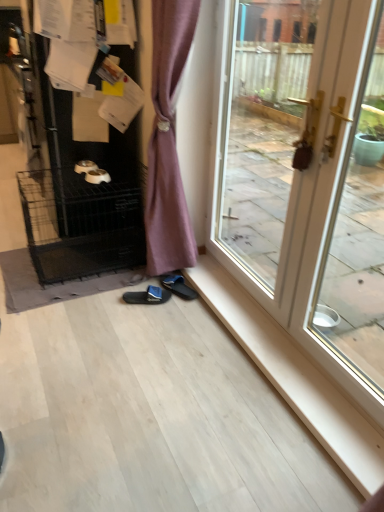
Locate an element on the screen. Image resolution: width=384 pixels, height=512 pixels. white glossy door at right is located at coordinates (261, 127).

Describe the element at coordinates (83, 176) in the screenshot. I see `black wire dog crate at left` at that location.

The image size is (384, 512). Identify the location of white glossy screen door at right. (358, 233).

Looking at this image, from the image's perspective, is white glossy screen door at right above black fabric slipper at lower center, which appears as the 2th footwear when viewed from the left?

Yes, from the image's perspective, white glossy screen door at right is on top of black fabric slipper at lower center, which appears as the 2th footwear when viewed from the left.

From a real-world perspective, is white glossy screen door at right positioned above or below black fabric slipper at lower center, which is the first footwear in right-to-left order?

In terms of real-world spatial position, white glossy screen door at right is above black fabric slipper at lower center, which is the first footwear in right-to-left order.

Is black fabric slipper at lower center, which appears as the 2th footwear when viewed from the left, at the back of white glossy screen door at right?

No, white glossy screen door at right's orientation is not away from black fabric slipper at lower center, which appears as the 2th footwear when viewed from the left.

Is black wire cage at left at the right side of black wire dog crate at left?

Correct, you'll find black wire cage at left to the right of black wire dog crate at left.

In the scene shown: Between black wire cage at left and black wire dog crate at left, which one has less height?

Standing shorter between the two is black wire cage at left.

From a real-world perspective, is black wire cage at left below black wire dog crate at left?

Yes.

Is there a large distance between black wire cage at left and black wire dog crate at left?

That's not correct — black wire cage at left is a little close to black wire dog crate at left.

Is there a large distance between white glossy door at right and black fabric slipper at lower center, which is counted as the 1th footwear, starting from the left?

Yes.

Considering the relative positions of white glossy door at right and black fabric slipper at lower center, the 2th footwear in the right-to-left sequence, in the image provided, is white glossy door at right in front of black fabric slipper at lower center, the 2th footwear in the right-to-left sequence,?

Yes.

Between white glossy door at right and black fabric slipper at lower center, which is counted as the 1th footwear, starting from the left, which one has smaller size?

Smaller between the two is black fabric slipper at lower center, which is counted as the 1th footwear, starting from the left.

Which of these two, white glossy door at right or black fabric slipper at lower center, the 2th footwear in the right-to-left sequence, is thinner?

white glossy door at right.

From the image's perspective, which object appears higher, black wire dog crate at left or white glossy screen door at right?

black wire dog crate at left, from the image's perspective.

Considering the relative sizes of black wire dog crate at left and white glossy screen door at right in the image provided, is black wire dog crate at left thinner than white glossy screen door at right?

No.

Find the location of a particular element. screen door above the black wire dog crate at left (from a real-world perspective) is located at coordinates (358, 233).

Considering the points (73, 151) and (344, 342), which point is behind, point (73, 151) or point (344, 342)?

The point (73, 151) is behind.

Can you confirm if black fabric slipper at lower center, which is the first footwear in right-to-left order, is thinner than black fabric slipper at lower center, the 2th footwear in the right-to-left sequence?

Yes, black fabric slipper at lower center, which is the first footwear in right-to-left order, is thinner than black fabric slipper at lower center, the 2th footwear in the right-to-left sequence.

Image resolution: width=384 pixels, height=512 pixels. Identify the location of footwear in front of the black fabric slipper at lower center, which appears as the 2th footwear when viewed from the left. (147, 296).

In the image, is black fabric slipper at lower center, which appears as the 2th footwear when viewed from the left, positioned in front of or behind black fabric slipper at lower center, which is counted as the 1th footwear, starting from the left?

black fabric slipper at lower center, which appears as the 2th footwear when viewed from the left, is behind black fabric slipper at lower center, which is counted as the 1th footwear, starting from the left.

From a real-world perspective, is white glossy door at right above or below black wire cage at left?

From a real-world perspective, white glossy door at right is physically above black wire cage at left.

The image size is (384, 512). Identify the location of cage below the white glossy door at right (from the image's perspective). (82, 222).

Are white glossy door at right and black wire cage at left making contact?

No, white glossy door at right is not beside black wire cage at left.

Is black wire cage at left completely or partially inside white glossy door at right?

No, black wire cage at left is located outside of white glossy door at right.

Is white glossy door at right surrounded by black fabric slipper at lower center, which is the first footwear in right-to-left order?

No, white glossy door at right is not surrounded by black fabric slipper at lower center, which is the first footwear in right-to-left order.

Which point is more forward, (192, 297) or (299, 9)?

The point (299, 9) is in front.

This screenshot has height=512, width=384. What are the coordinates of `window above the black fabric slipper at lower center, which is the first footwear in right-to-left order (from the image's perspective)` in the screenshot? It's located at (261, 127).

From a real-world perspective, is black fabric slipper at lower center, which appears as the 2th footwear when viewed from the left, below white glossy door at right?

Yes, from a real-world perspective, black fabric slipper at lower center, which appears as the 2th footwear when viewed from the left, is under white glossy door at right.

Identify the location of screen door above the black fabric slipper at lower center, which appears as the 2th footwear when viewed from the left (from a real-world perspective). (358, 233).

Where is `appliance that is in front of the black wire cage at left`? The height and width of the screenshot is (512, 384). appliance that is in front of the black wire cage at left is located at coordinates (83, 176).

Looking at the image, which one is located further to white glossy door at right, black fabric slipper at lower center, which is counted as the 1th footwear, starting from the left, or black wire dog crate at left?

The object further to white glossy door at right is black fabric slipper at lower center, which is counted as the 1th footwear, starting from the left.

Looking at the image, which one is located further to white glossy door at right, black wire cage at left or black wire dog crate at left?

Among the two, black wire cage at left is located further to white glossy door at right.

Looking at the image, which one is located closer to white glossy screen door at right, black fabric slipper at lower center, which is the first footwear in right-to-left order, or black fabric slipper at lower center, the 2th footwear in the right-to-left sequence?

Among the two, black fabric slipper at lower center, which is the first footwear in right-to-left order, is located nearer to white glossy screen door at right.

Which object lies further to the anchor point black wire dog crate at left, black fabric slipper at lower center, which is the first footwear in right-to-left order, or black fabric slipper at lower center, the 2th footwear in the right-to-left sequence?

black fabric slipper at lower center, which is the first footwear in right-to-left order, is positioned further to the anchor black wire dog crate at left.

Estimate the real-world distances between objects in this image. Which object is closer to black fabric slipper at lower center, the 2th footwear in the right-to-left sequence, white glossy screen door at right or black wire cage at left?

Based on the image, black wire cage at left appears to be nearer to black fabric slipper at lower center, the 2th footwear in the right-to-left sequence.

Considering their positions, is black fabric slipper at lower center, which is the first footwear in right-to-left order, positioned further to white glossy door at right than black fabric slipper at lower center, the 2th footwear in the right-to-left sequence?

Based on the image, black fabric slipper at lower center, the 2th footwear in the right-to-left sequence, appears to be further to white glossy door at right.

From the picture: Based on their spatial positions, is black wire cage at left or white glossy door at right further from black fabric slipper at lower center, which is counted as the 1th footwear, starting from the left?

Among the two, white glossy door at right is located further to black fabric slipper at lower center, which is counted as the 1th footwear, starting from the left.

Which object lies nearer to the anchor point black fabric slipper at lower center, which is the first footwear in right-to-left order, black wire cage at left or black wire dog crate at left?

black wire cage at left lies closer to black fabric slipper at lower center, which is the first footwear in right-to-left order, than the other object.

Where is `footwear between white glossy door at right and black fabric slipper at lower center, which appears as the 2th footwear when viewed from the left, from front to back`? The width and height of the screenshot is (384, 512). footwear between white glossy door at right and black fabric slipper at lower center, which appears as the 2th footwear when viewed from the left, from front to back is located at coordinates (147, 296).

You are a GUI agent. You are given a task and a screenshot of the screen. Output one action in this format:
    pyautogui.click(x=<x>, y=<y>)
    Task: Click on the appliance between white glossy screen door at right and black fabric slipper at lower center, which is counted as the 1th footwear, starting from the left, from front to back
    The image size is (384, 512).
    Given the screenshot: What is the action you would take?
    pyautogui.click(x=83, y=176)

Locate an element on the screen. The width and height of the screenshot is (384, 512). window between white glossy screen door at right and black fabric slipper at lower center, which is counted as the 1th footwear, starting from the left, along the z-axis is located at coordinates (261, 127).

Identify the location of window located between black wire dog crate at left and white glossy screen door at right in the left-right direction. (261, 127).